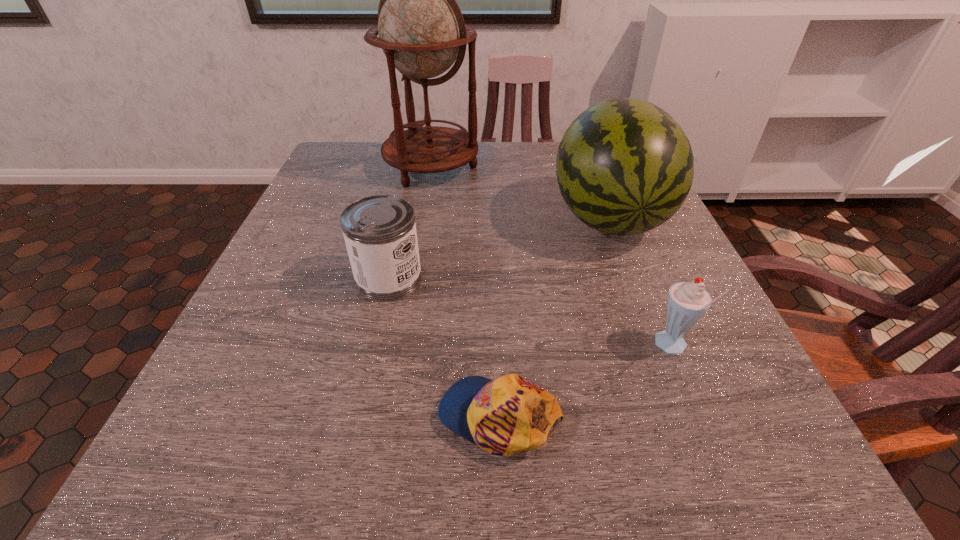
Identify the location of milkshake located in the right edge section of the desktop. Image resolution: width=960 pixels, height=540 pixels. (687, 302).

Find the location of a particular element. This screenshot has width=960, height=540. object located at the far left corner is located at coordinates (421, 29).

I want to click on object that is at the far right corner, so click(624, 166).

In the image, there is a desktop. Find the location of `blank space at the far edge`. blank space at the far edge is located at coordinates (525, 157).

In the image, there is a desktop. In order to click on vacant area at the near edge in this screenshot , I will do `click(416, 457)`.

Locate an element on the screen. free space at the left edge of the desktop is located at coordinates (324, 227).

You are a GUI agent. You are given a task and a screenshot of the screen. Output one action in this format:
    pyautogui.click(x=<x>, y=<y>)
    Task: Click on the vacant region at the right edge of the desktop
    This screenshot has width=960, height=540.
    Given the screenshot: What is the action you would take?
    pyautogui.click(x=618, y=286)

Find the location of `vacant area at the far left corner`. vacant area at the far left corner is located at coordinates click(320, 188).

Find the location of a particular element. This screenshot has height=540, width=960. free location at the near left corner of the desktop is located at coordinates (202, 487).

You are a GUI agent. You are given a task and a screenshot of the screen. Output one action in this format:
    pyautogui.click(x=<x>, y=<y>)
    Task: Click on the vacant region between the tallest object and the fourth farthest object
    
    Given the screenshot: What is the action you would take?
    pyautogui.click(x=552, y=257)